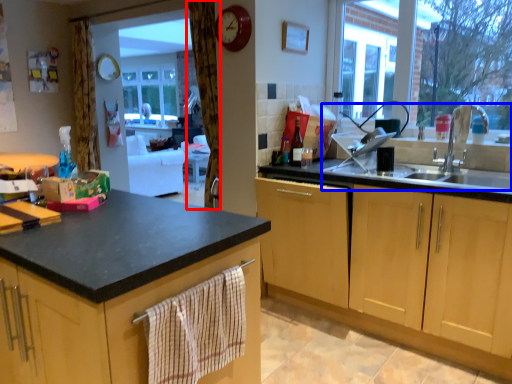
Question: Which object is closer to the camera taking this photo, curtain (highlighted by a red box) or sink (highlighted by a blue box)?

Choices:
 (A) curtain
 (B) sink

Answer: (B)